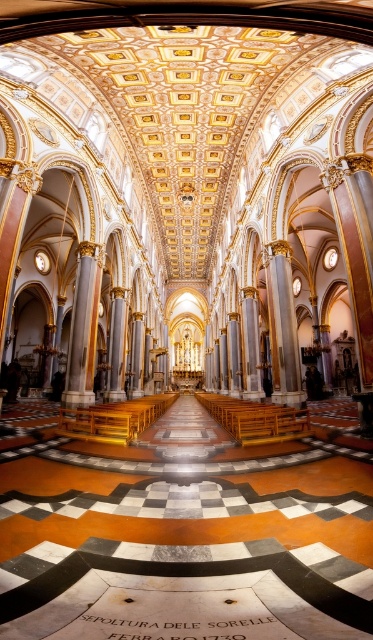
Question: Does white marble column at center lie behind gold polished pillar at center?

Choices:
 (A) yes
 (B) no

Answer: (A)

Question: In this image, where is white marble column at center located relative to gold polished pillar at center?

Choices:
 (A) right
 (B) left

Answer: (B)

Question: Is the position of gold polished pillar at center less distant than that of slate gray stone pillar at center?

Choices:
 (A) yes
 (B) no

Answer: (A)

Question: Which is nearer to the slate gray stone pillar at center?

Choices:
 (A) white marble column at center
 (B) gold polished pillar at center

Answer: (A)

Question: Which point is closer to the camera?

Choices:
 (A) (76, 332)
 (B) (117, 376)

Answer: (A)

Question: Which is nearer to the slate gray stone pillar at center?

Choices:
 (A) gold polished pillar at center
 (B) white marble column at center

Answer: (B)